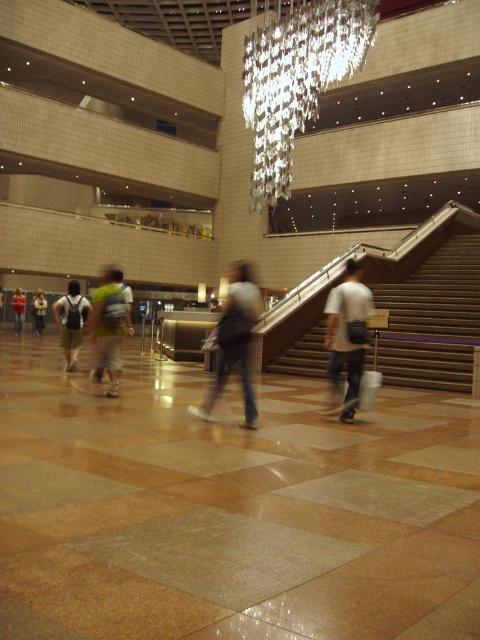
You are an architect designing a new lighting plan for the building. The clear crystal chandelier at upper center is currently positioned at coordinates point 0.123, 0.619. To ensure proper lighting distribution, you need to place a new spotlight directly below it. What are the coordinates where the spotlight should be placed?

The clear crystal chandelier at upper center is at point (297, 77), so the spotlight should be placed directly below it at coordinates (297, 77).

You are standing in the building and looking up. There is a point marked at coordinates point (297, 77). What object is located at that point?

The point (297, 77) indicates the clear crystal chandelier at upper center.